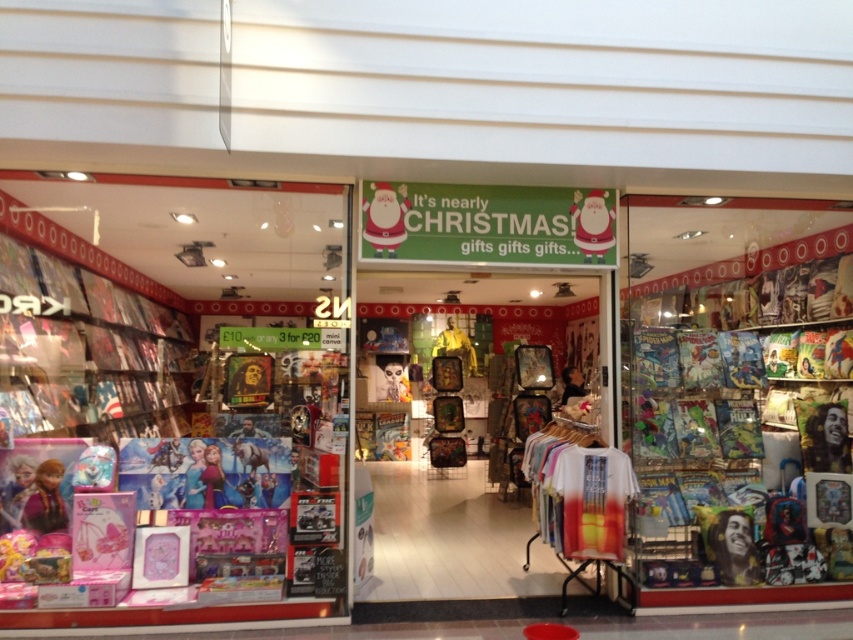
Question: Is metallic comic books at right above matte plastic santa at center?

Choices:
 (A) no
 (B) yes

Answer: (A)

Question: Does metallic comic books at right have a smaller size compared to matte plastic santa at center?

Choices:
 (A) yes
 (B) no

Answer: (B)

Question: Which object appears farthest from the camera in this image?

Choices:
 (A) metallic comic books at right
 (B) matte plastic santa at center

Answer: (A)

Question: Among these objects, which one is nearest to the camera?

Choices:
 (A) metallic comic books at right
 (B) matte plastic santa at center

Answer: (B)

Question: Which of the following is the closest to the observer?

Choices:
 (A) matte plastic santa at center
 (B) metallic comic books at right

Answer: (A)

Question: Can you confirm if metallic comic books at right is positioned below matte plastic santa at center?

Choices:
 (A) yes
 (B) no

Answer: (A)